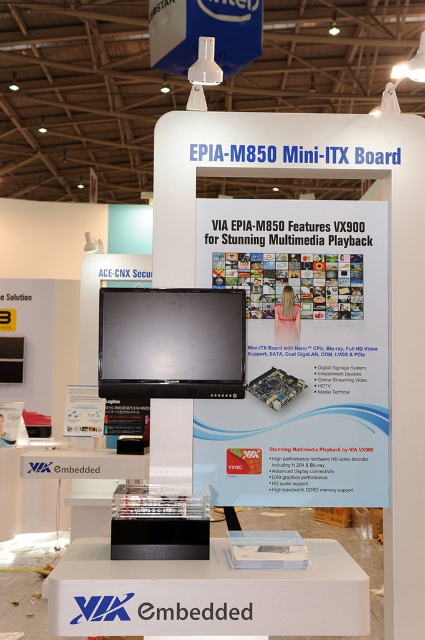
Question: Does silver metallic motherboard at center have a larger size compared to blonde hair at upper center?

Choices:
 (A) no
 (B) yes

Answer: (B)

Question: Estimate the real-world distances between objects in this image. Which object is farther from the white glossy poster at center?

Choices:
 (A) matte black monitor at center
 (B) blonde hair at upper center

Answer: (A)

Question: Is matte black monitor at center wider than blonde hair at upper center?

Choices:
 (A) yes
 (B) no

Answer: (A)

Question: Which point is closer to the camera?

Choices:
 (A) silver metallic motherboard at center
 (B) white glossy poster at center
 (C) blonde hair at upper center
 (D) matte black monitor at center

Answer: (D)

Question: Considering the relative positions of white glossy poster at center and silver metallic motherboard at center in the image provided, where is white glossy poster at center located with respect to silver metallic motherboard at center?

Choices:
 (A) right
 (B) left

Answer: (A)

Question: Which point appears farthest from the camera in this image?

Choices:
 (A) (249, 289)
 (B) (155, 336)
 (C) (255, 381)
 (D) (289, 308)

Answer: (A)